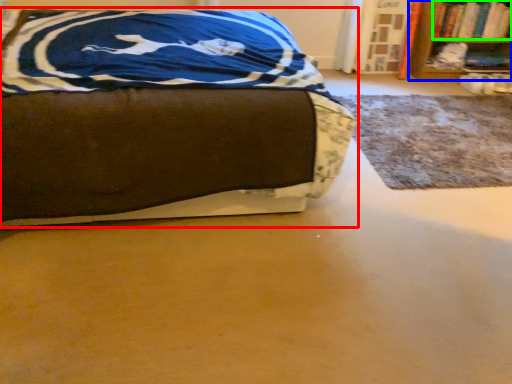
Question: Considering the real-world distances, which object is closest to bed (highlighted by a red box)? bookcase (highlighted by a blue box) or book (highlighted by a green box).

Choices:
 (A) bookcase
 (B) book

Answer: (A)